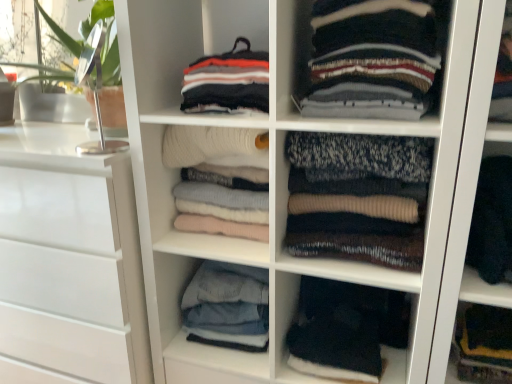
Question: Does dark wool sweater at right, placed as the 1th clothing when sorted from right to left, turn towards denim jeans at center, arranged as the 1th clothing when viewed from the left?

Choices:
 (A) no
 (B) yes

Answer: (A)

Question: Considering the relative sizes of dark wool sweater at right, the 6th clothing from the left, and denim jeans at center, positioned as the 6th clothing in right-to-left order, in the image provided, is dark wool sweater at right, the 6th clothing from the left, wider than denim jeans at center, positioned as the 6th clothing in right-to-left order,?

Choices:
 (A) yes
 (B) no

Answer: (A)

Question: Considering the relative sizes of dark wool sweater at right, the 6th clothing from the left, and denim jeans at center, positioned as the 6th clothing in right-to-left order, in the image provided, is dark wool sweater at right, the 6th clothing from the left, thinner than denim jeans at center, positioned as the 6th clothing in right-to-left order,?

Choices:
 (A) yes
 (B) no

Answer: (B)

Question: Does dark wool sweater at right, placed as the 1th clothing when sorted from right to left, appear on the right side of denim jeans at center, arranged as the 1th clothing when viewed from the left?

Choices:
 (A) no
 (B) yes

Answer: (B)

Question: Can you see dark wool sweater at right, placed as the 1th clothing when sorted from right to left, touching denim jeans at center, positioned as the 6th clothing in right-to-left order?

Choices:
 (A) yes
 (B) no

Answer: (B)

Question: Is white glossy chest of drawers at left spatially inside dark wool sweater at right, the 6th clothing from the left, or outside of it?

Choices:
 (A) outside
 (B) inside

Answer: (A)

Question: Considering the positions of white glossy chest of drawers at left and dark wool sweater at right, placed as the 1th clothing when sorted from right to left, in the image, is white glossy chest of drawers at left wider or thinner than dark wool sweater at right, placed as the 1th clothing when sorted from right to left,?

Choices:
 (A) wide
 (B) thin

Answer: (A)

Question: From a real-world perspective, is white glossy chest of drawers at left above or below dark wool sweater at right, placed as the 1th clothing when sorted from right to left?

Choices:
 (A) below
 (B) above

Answer: (A)

Question: From their relative heights in the image, would you say white glossy chest of drawers at left is taller or shorter than dark wool sweater at right, the 6th clothing from the left?

Choices:
 (A) short
 (B) tall

Answer: (B)

Question: Is soft white sweater at center, which is counted as the second clothing, starting from the left, inside the boundaries of striped wool sweater at center, which appears as the 2th clothing when viewed from the right, or outside?

Choices:
 (A) inside
 (B) outside

Answer: (B)

Question: From a real-world perspective, relative to striped wool sweater at center, which appears as the 2th clothing when viewed from the right, is soft white sweater at center, which appears as the fifth clothing when viewed from the right, vertically above or below?

Choices:
 (A) below
 (B) above

Answer: (A)

Question: From the image's perspective, is soft white sweater at center, which appears as the fifth clothing when viewed from the right, positioned above or below striped wool sweater at center, which appears as the 2th clothing when viewed from the right?

Choices:
 (A) above
 (B) below

Answer: (B)

Question: In terms of height, does soft white sweater at center, which is counted as the second clothing, starting from the left, look taller or shorter compared to striped wool sweater at center, which appears as the 2th clothing when viewed from the right?

Choices:
 (A) short
 (B) tall

Answer: (B)

Question: From the image's perspective, is soft white sweater at center, which is counted as the second clothing, starting from the left, positioned above or below knit sweater at center, the 3th clothing in the right-to-left sequence?

Choices:
 (A) below
 (B) above

Answer: (B)

Question: Is point (246, 177) closer or farther from the camera than point (295, 145)?

Choices:
 (A) farther
 (B) closer

Answer: (A)